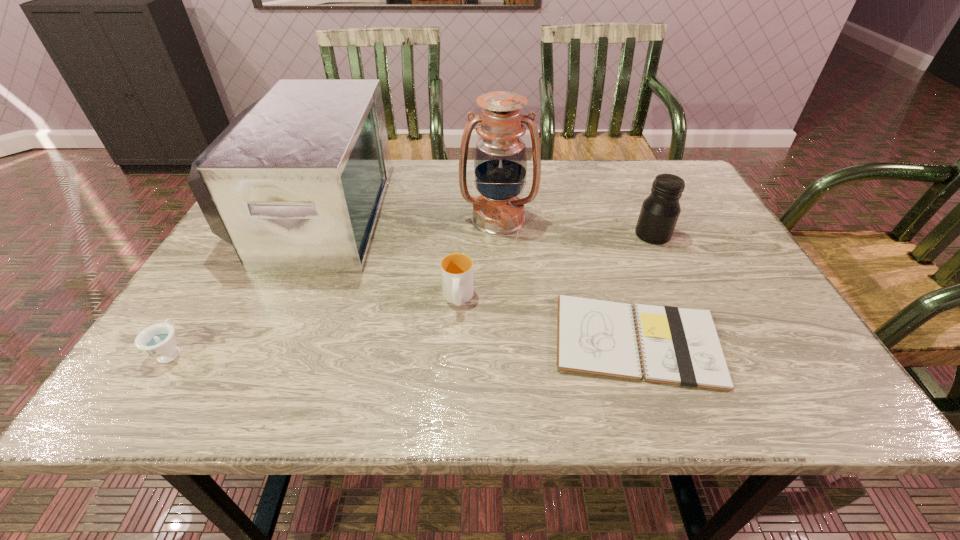
This screenshot has width=960, height=540. I want to click on jar located in the right edge section of the desktop, so click(660, 211).

At what (x,y) coordinates should I click in order to perform the action: click on notepad present at the right edge. Please return your answer as a coordinate pair (x, y). The image size is (960, 540). Looking at the image, I should click on (678, 346).

Where is `object that is at the far left corner`? The image size is (960, 540). object that is at the far left corner is located at coordinates (295, 183).

You are a GUI agent. You are given a task and a screenshot of the screen. Output one action in this format:
    pyautogui.click(x=<x>, y=<y>)
    Task: Click on the object that is at the near left corner
    Image resolution: width=960 pixels, height=540 pixels.
    Given the screenshot: What is the action you would take?
    pyautogui.click(x=158, y=340)

Identify the location of object at the near right corner. This screenshot has width=960, height=540. (678, 346).

The height and width of the screenshot is (540, 960). Find the location of `vacant space at the far edge of the desktop`. vacant space at the far edge of the desktop is located at coordinates (396, 202).

Where is `vacant space at the near edge`? This screenshot has height=540, width=960. vacant space at the near edge is located at coordinates (277, 396).

This screenshot has width=960, height=540. In order to click on vacant space at the left edge in this screenshot , I will do `click(209, 342)`.

Find the location of a particular element. free space at the right edge is located at coordinates (728, 269).

The height and width of the screenshot is (540, 960). What are the coordinates of `vacant region at the near left corner of the desktop` in the screenshot? It's located at (150, 380).